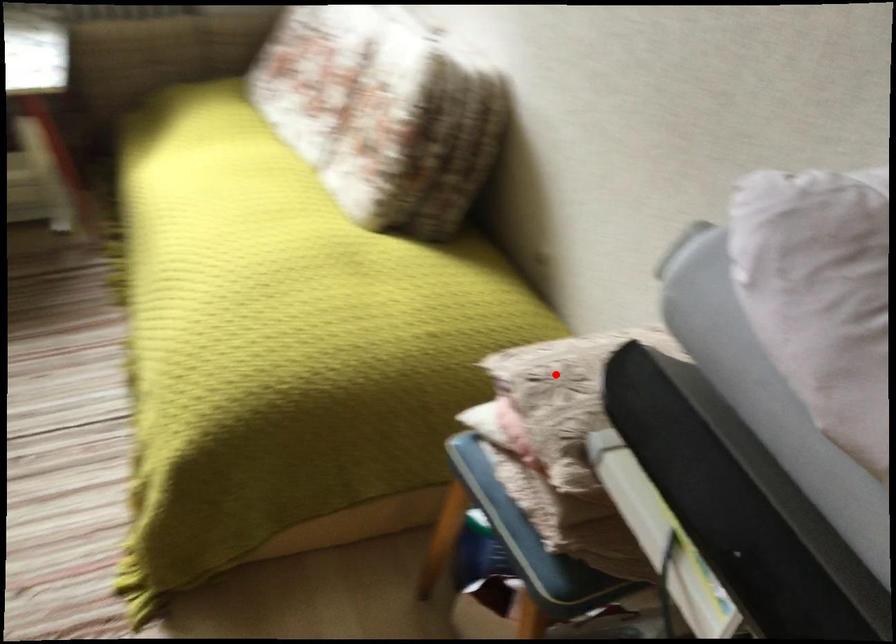
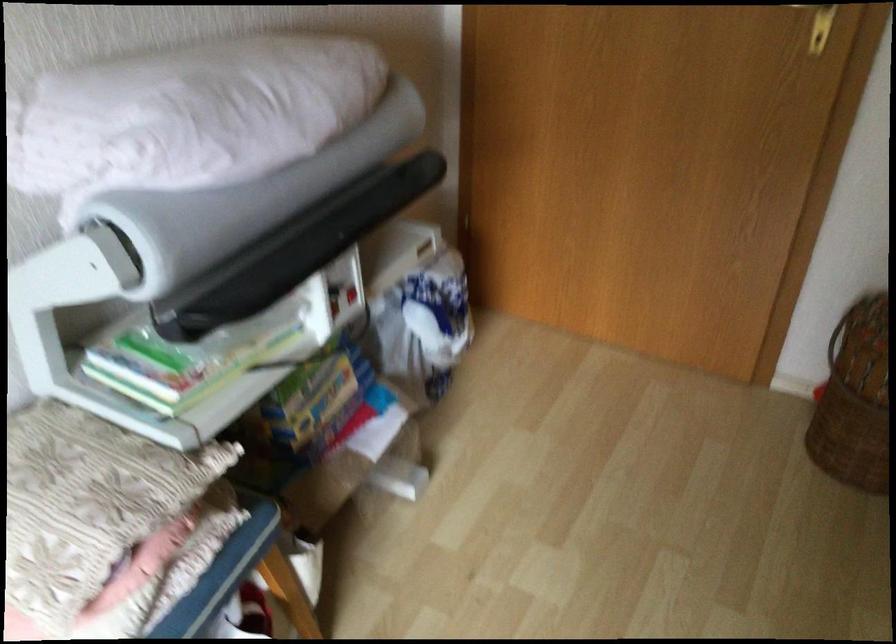
Question: I am providing you with two images of the same scene from different viewpoints. A red point is shown in image1. For the corresponding object point in image2, is it positioned nearer or farther from the camera?

Choices:
 (A) Nearer
 (B) Farther

Answer: (A)